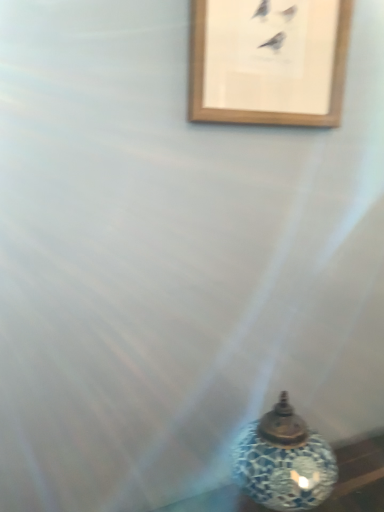
Question: Does blue mosaic oil lamp at lower right have a greater width compared to wooden picture frame at upper center?

Choices:
 (A) no
 (B) yes

Answer: (B)

Question: Considering the relative sizes of blue mosaic oil lamp at lower right and wooden picture frame at upper center in the image provided, is blue mosaic oil lamp at lower right smaller than wooden picture frame at upper center?

Choices:
 (A) yes
 (B) no

Answer: (B)

Question: Is blue mosaic oil lamp at lower right to the left of wooden picture frame at upper center from the viewer's perspective?

Choices:
 (A) yes
 (B) no

Answer: (B)

Question: Does blue mosaic oil lamp at lower right come behind wooden picture frame at upper center?

Choices:
 (A) no
 (B) yes

Answer: (A)

Question: Is blue mosaic oil lamp at lower right thinner than wooden picture frame at upper center?

Choices:
 (A) no
 (B) yes

Answer: (A)

Question: From a real-world perspective, is blue mosaic oil lamp at lower right physically above wooden picture frame at upper center?

Choices:
 (A) yes
 (B) no

Answer: (B)

Question: From a real-world perspective, is wooden picture frame at upper center below blue mosaic oil lamp at lower right?

Choices:
 (A) no
 (B) yes

Answer: (A)

Question: Is the depth of wooden picture frame at upper center greater than that of blue mosaic oil lamp at lower right?

Choices:
 (A) yes
 (B) no

Answer: (A)

Question: Is wooden picture frame at upper center at the left side of blue mosaic oil lamp at lower right?

Choices:
 (A) yes
 (B) no

Answer: (A)

Question: Is blue mosaic oil lamp at lower right at the back of wooden picture frame at upper center?

Choices:
 (A) yes
 (B) no

Answer: (B)

Question: Does wooden picture frame at upper center contain blue mosaic oil lamp at lower right?

Choices:
 (A) yes
 (B) no

Answer: (B)

Question: Does wooden picture frame at upper center have a lesser width compared to blue mosaic oil lamp at lower right?

Choices:
 (A) no
 (B) yes

Answer: (B)

Question: In terms of height, does blue mosaic oil lamp at lower right look taller or shorter compared to wooden picture frame at upper center?

Choices:
 (A) short
 (B) tall

Answer: (B)